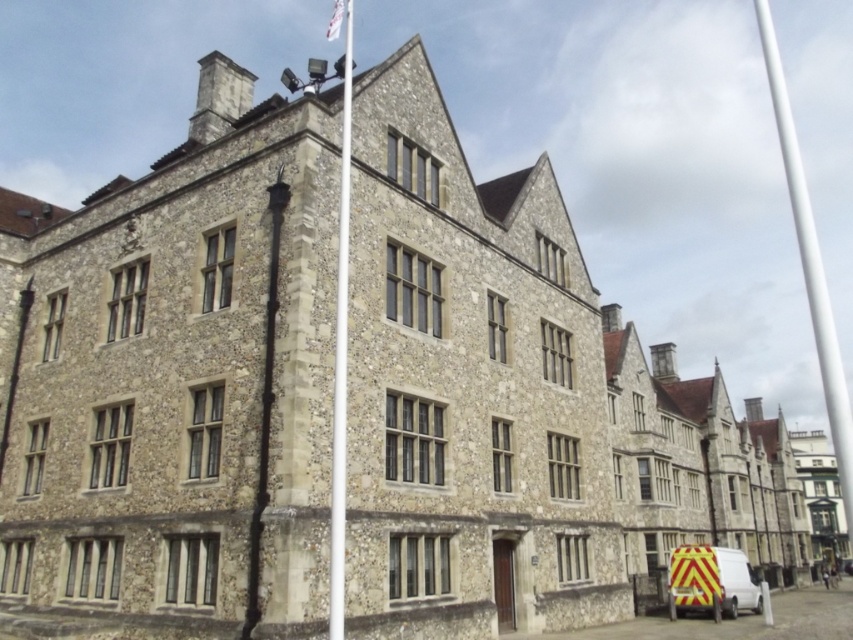
Does white smooth pole at upper right lie in front of yellow reflective van at lower right?

No, white smooth pole at upper right is behind yellow reflective van at lower right.

Is point (775, 58) less distant than point (735, 570)?

No, it is behind (735, 570).

Between point (813, 237) and point (740, 602), which one is positioned behind?

The point (813, 237) is more distant.

Locate an element on the screen. This screenshot has width=853, height=640. white smooth pole at upper right is located at coordinates pyautogui.click(x=810, y=268).

Measure the distance between yellow reflective van at lower right and camera.

yellow reflective van at lower right is 200.28 feet away from camera.

Between yellow reflective van at lower right and white fabric flag at upper center, which one is positioned lower?

yellow reflective van at lower right

Which is in front, point (746, 579) or point (332, 19)?

Point (746, 579) is in front.

You are a GUI agent. You are given a task and a screenshot of the screen. Output one action in this format:
    pyautogui.click(x=<x>, y=<y>)
    Task: Click on the yellow reflective van at lower right
    Image resolution: width=853 pixels, height=640 pixels.
    Given the screenshot: What is the action you would take?
    pyautogui.click(x=712, y=579)

Where is `white smooth pole at upper right`? This screenshot has height=640, width=853. white smooth pole at upper right is located at coordinates (810, 268).

Between point (785, 106) and point (335, 13), which one is positioned in front?

Point (335, 13)

Locate an element on the screen. white smooth pole at upper right is located at coordinates (810, 268).